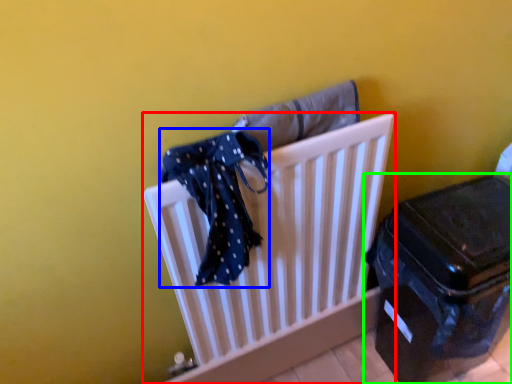
Question: Which object is the closest to the furniture (highlighted by a red box)? Choose among these: scarf (highlighted by a blue box) or suitcase (highlighted by a green box).

Choices:
 (A) scarf
 (B) suitcase

Answer: (A)